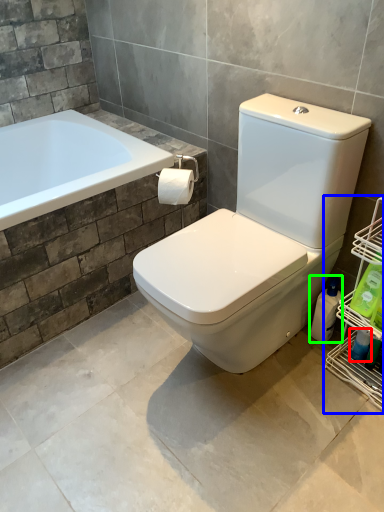
Question: Considering the real-world distances, which object is closest to cleaning product (highlighted by a red box)? shelf (highlighted by a blue box) or cleaning product (highlighted by a green box).

Choices:
 (A) shelf
 (B) cleaning product

Answer: (B)